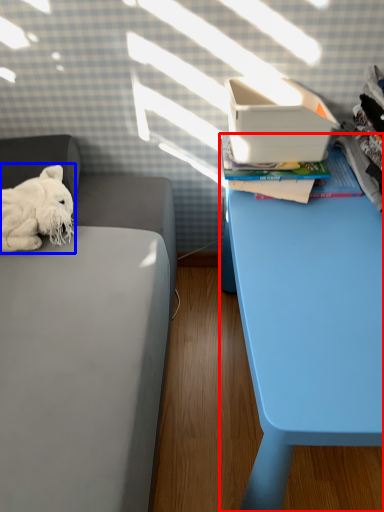
Question: Which point is closer to the camera, table (highlighted by a red box) or dog (highlighted by a blue box)?

Choices:
 (A) table
 (B) dog

Answer: (A)